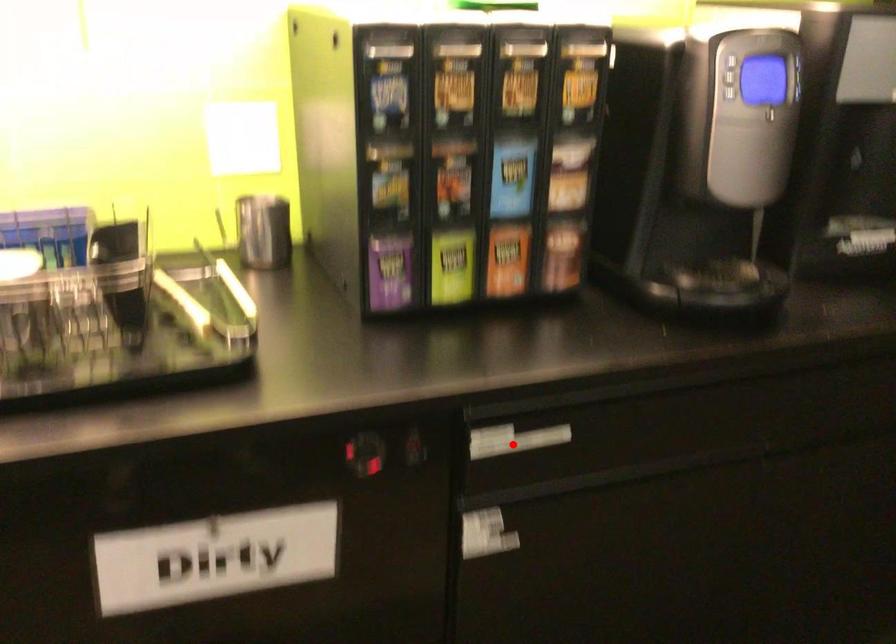
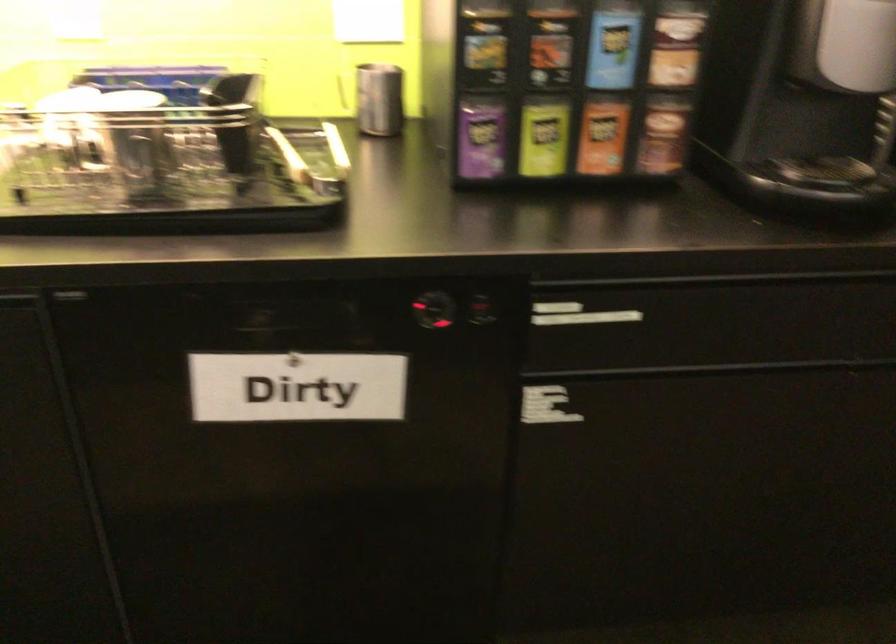
Locate, in the second image, the point that corresponds to the highlighted location in the first image.

(578, 315)